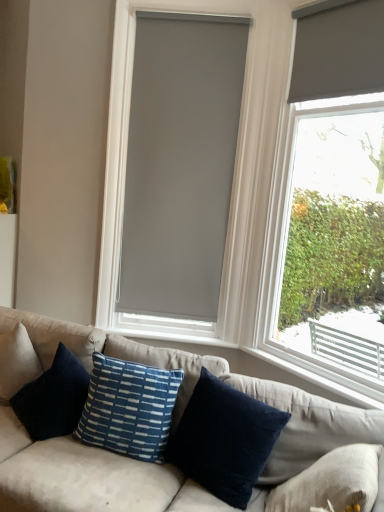
Question: Does blue textured pillow at center, the second pillow when ordered from right to left, turn towards matte gray roller blind at right?

Choices:
 (A) no
 (B) yes

Answer: (A)

Question: Is blue textured pillow at center, which is counted as the first pillow, starting from the left, looking in the opposite direction of matte gray roller blind at right?

Choices:
 (A) no
 (B) yes

Answer: (A)

Question: Considering the relative sizes of blue textured pillow at center, the second pillow when ordered from right to left, and matte gray roller blind at right in the image provided, is blue textured pillow at center, the second pillow when ordered from right to left, wider than matte gray roller blind at right?

Choices:
 (A) yes
 (B) no

Answer: (A)

Question: Are blue textured pillow at center, which is counted as the first pillow, starting from the left, and matte gray roller blind at right making contact?

Choices:
 (A) yes
 (B) no

Answer: (B)

Question: Is blue textured pillow at center, which is counted as the first pillow, starting from the left, thinner than matte gray roller blind at right?

Choices:
 (A) no
 (B) yes

Answer: (A)

Question: Considering the relative positions of blue textured pillow at center, the second pillow when ordered from right to left, and matte gray roller blind at right in the image provided, is blue textured pillow at center, the second pillow when ordered from right to left, to the right of matte gray roller blind at right from the viewer's perspective?

Choices:
 (A) yes
 (B) no

Answer: (B)

Question: Is navy blue cotton pillow at center, marked as the first pillow in a right-to-left arrangement, positioned before blue textured pillow at center, the second pillow when ordered from right to left?

Choices:
 (A) no
 (B) yes

Answer: (B)

Question: Considering the relative sizes of navy blue cotton pillow at center, the second pillow from the left, and blue textured pillow at center, the second pillow when ordered from right to left, in the image provided, is navy blue cotton pillow at center, the second pillow from the left, wider than blue textured pillow at center, the second pillow when ordered from right to left,?

Choices:
 (A) no
 (B) yes

Answer: (A)

Question: Is navy blue cotton pillow at center, marked as the first pillow in a right-to-left arrangement, facing towards blue textured pillow at center, the second pillow when ordered from right to left?

Choices:
 (A) no
 (B) yes

Answer: (A)

Question: Is navy blue cotton pillow at center, the second pillow from the left, oriented away from blue textured pillow at center, which is counted as the first pillow, starting from the left?

Choices:
 (A) no
 (B) yes

Answer: (A)

Question: From the image's perspective, is navy blue cotton pillow at center, the second pillow from the left, located beneath blue textured pillow at center, which is counted as the first pillow, starting from the left?

Choices:
 (A) yes
 (B) no

Answer: (A)

Question: Is navy blue cotton pillow at center, marked as the first pillow in a right-to-left arrangement, shorter than blue textured pillow at center, which is counted as the first pillow, starting from the left?

Choices:
 (A) no
 (B) yes

Answer: (A)

Question: From a real-world perspective, is navy blue cotton pillow at center, marked as the first pillow in a right-to-left arrangement, below matte gray roller blind at upper right, the first window blind in the front-to-back sequence?

Choices:
 (A) yes
 (B) no

Answer: (A)